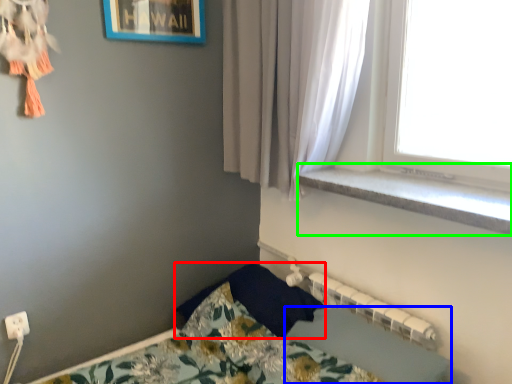
Question: Which object is positioned closest to pillow (highlighted by a red box)? Select from sheet (highlighted by a blue box) and window sill (highlighted by a green box).

Choices:
 (A) sheet
 (B) window sill

Answer: (A)